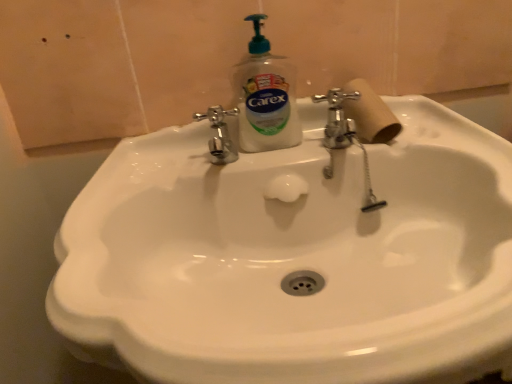
Question: Considering the relative sizes of clear plastic soap dispenser at center and white glossy sink at center in the image provided, is clear plastic soap dispenser at center thinner than white glossy sink at center?

Choices:
 (A) yes
 (B) no

Answer: (A)

Question: Can you confirm if clear plastic soap dispenser at center is positioned to the right of white glossy sink at center?

Choices:
 (A) no
 (B) yes

Answer: (A)

Question: Is clear plastic soap dispenser at center wider than white glossy sink at center?

Choices:
 (A) yes
 (B) no

Answer: (B)

Question: From the image's perspective, is clear plastic soap dispenser at center on top of white glossy sink at center?

Choices:
 (A) no
 (B) yes

Answer: (B)

Question: Does clear plastic soap dispenser at center turn towards white glossy sink at center?

Choices:
 (A) yes
 (B) no

Answer: (B)

Question: From a real-world perspective, is clear plastic soap dispenser at center on white glossy sink at center?

Choices:
 (A) no
 (B) yes

Answer: (B)

Question: Does white glossy sink at center come behind wooden at right?

Choices:
 (A) yes
 (B) no

Answer: (B)

Question: Does white glossy sink at center contain wooden at right?

Choices:
 (A) no
 (B) yes

Answer: (B)

Question: Considering the relative sizes of white glossy sink at center and wooden at right in the image provided, is white glossy sink at center thinner than wooden at right?

Choices:
 (A) yes
 (B) no

Answer: (B)

Question: Does white glossy sink at center have a larger size compared to wooden at right?

Choices:
 (A) yes
 (B) no

Answer: (A)

Question: Is white glossy sink at center shorter than wooden at right?

Choices:
 (A) yes
 (B) no

Answer: (B)

Question: From a real-world perspective, is white glossy sink at center over wooden at right?

Choices:
 (A) yes
 (B) no

Answer: (B)

Question: From the image's perspective, is wooden at right below white glossy sink at center?

Choices:
 (A) yes
 (B) no

Answer: (B)